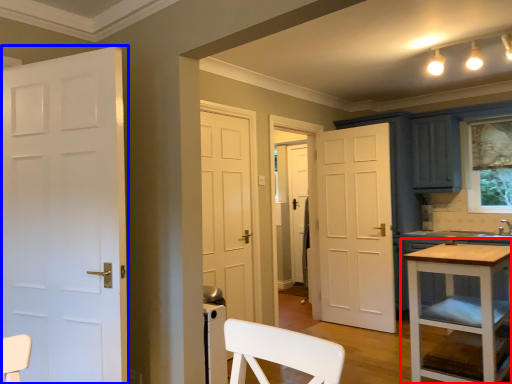
Question: Which object is further to the camera taking this photo, table (highlighted by a red box) or door (highlighted by a blue box)?

Choices:
 (A) table
 (B) door

Answer: (A)